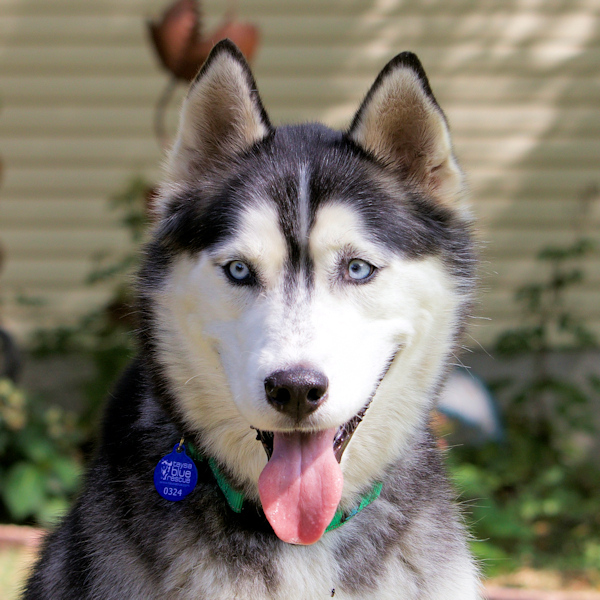
You are a GUI agent. You are given a task and a screenshot of the screen. Output one action in this format:
    pyautogui.click(x=<x>, y=<y>)
    Task: Click on the blinds
    Image resolution: width=600 pixels, height=600 pixels.
    Given the screenshot: What is the action you would take?
    pyautogui.click(x=85, y=77)